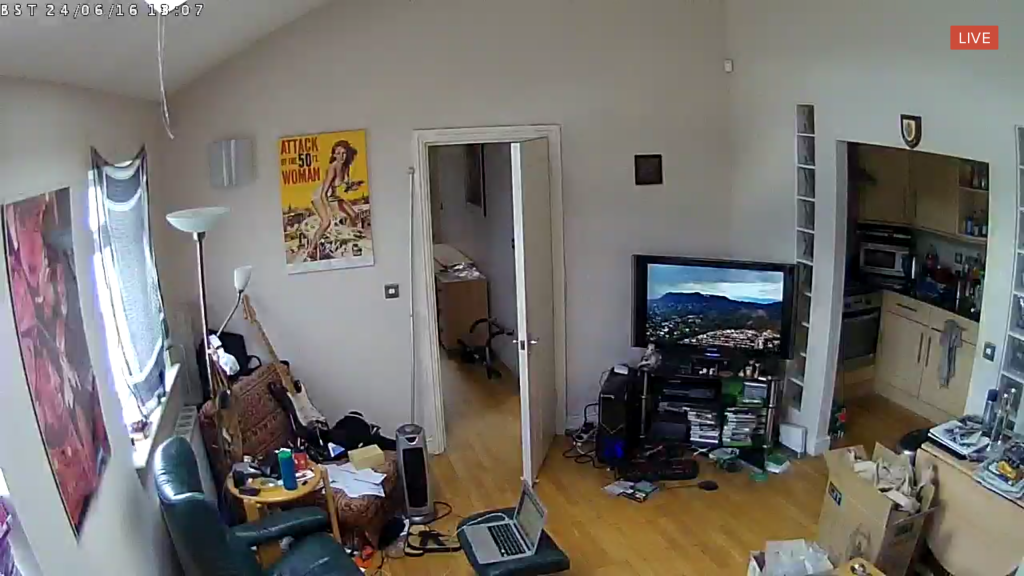
Image resolution: width=1024 pixels, height=576 pixels. In order to click on b movie poster in this screenshot , I will do `click(314, 204)`.